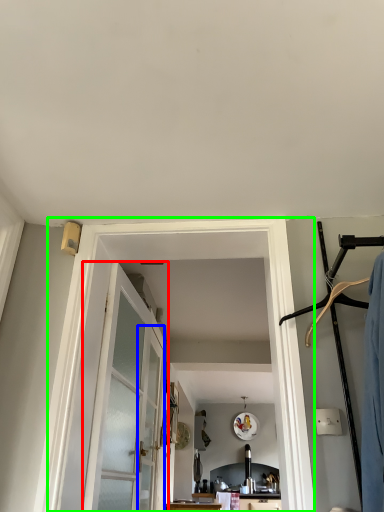
Question: Considering the real-world distances, which object is closest to door (highlighted by a red box)? screen door (highlighted by a blue box) or barn door (highlighted by a green box).

Choices:
 (A) screen door
 (B) barn door

Answer: (A)